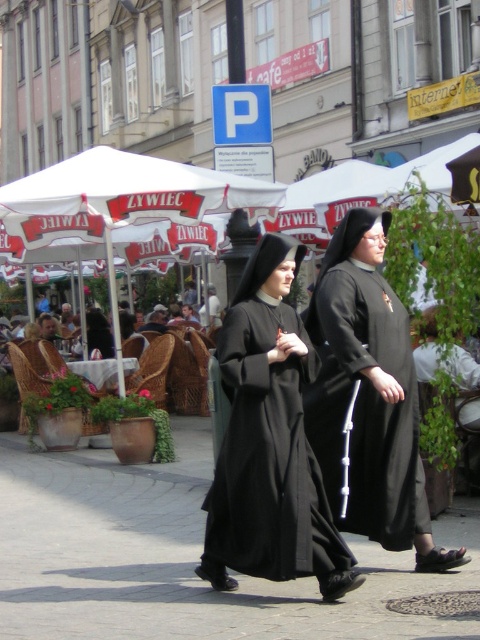
Looking at this image, you are a photographer standing in the square and want to take a photo of both the black matte dress at center and the matte black nun at center. Which one should you focus on first if you want to capture both in the same frame without moving the camera?

The black matte dress at center is taller than the matte black nun at center, so you should focus on the black matte dress at center first to ensure it fits within the frame before adjusting for the shorter figure.

You are standing in the city square and see the point marked at coordinates (369, 396). What object is located at that point?

The point at coordinates (369, 396) corresponds to the black matte nun s habit at center.